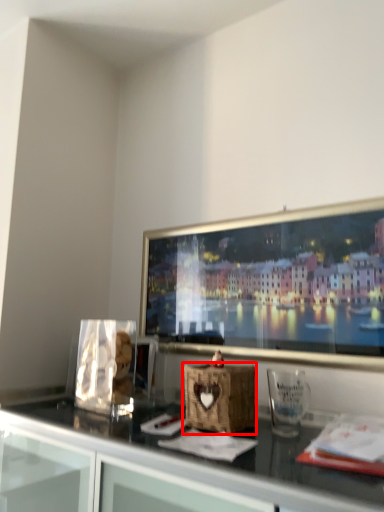
Question: In this image, where is basket (annotated by the red box) located relative to glass vase?

Choices:
 (A) left
 (B) right

Answer: (A)